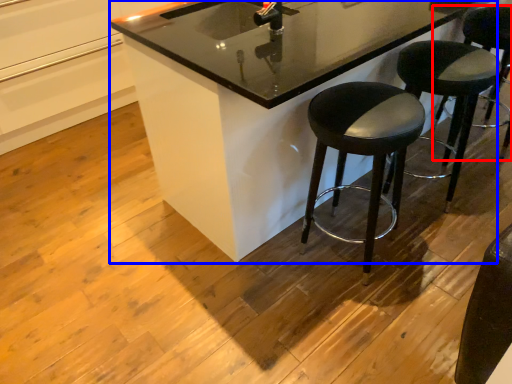
Question: Among these objects, which one is farthest to the camera, stool (highlighted by a red box) or counter (highlighted by a blue box)?

Choices:
 (A) stool
 (B) counter

Answer: (A)